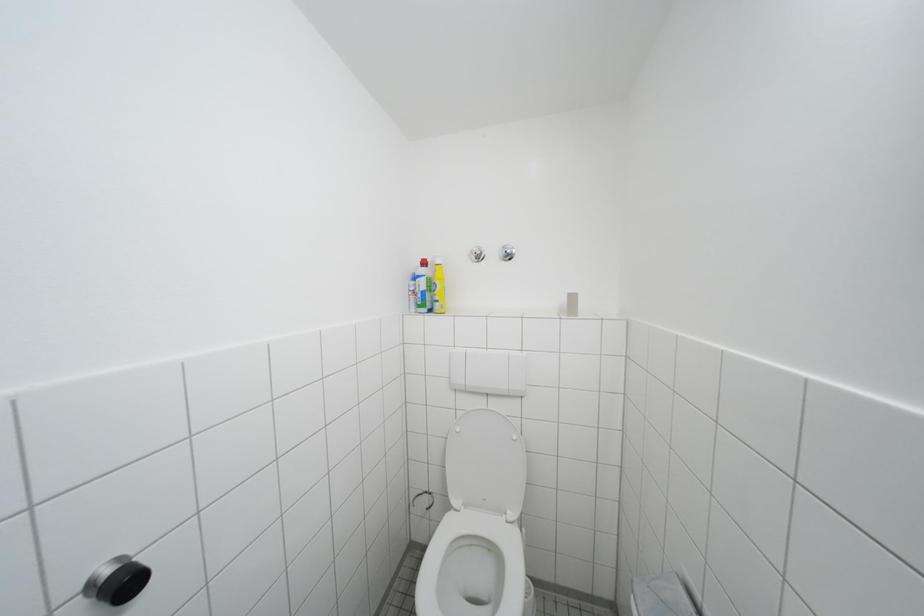
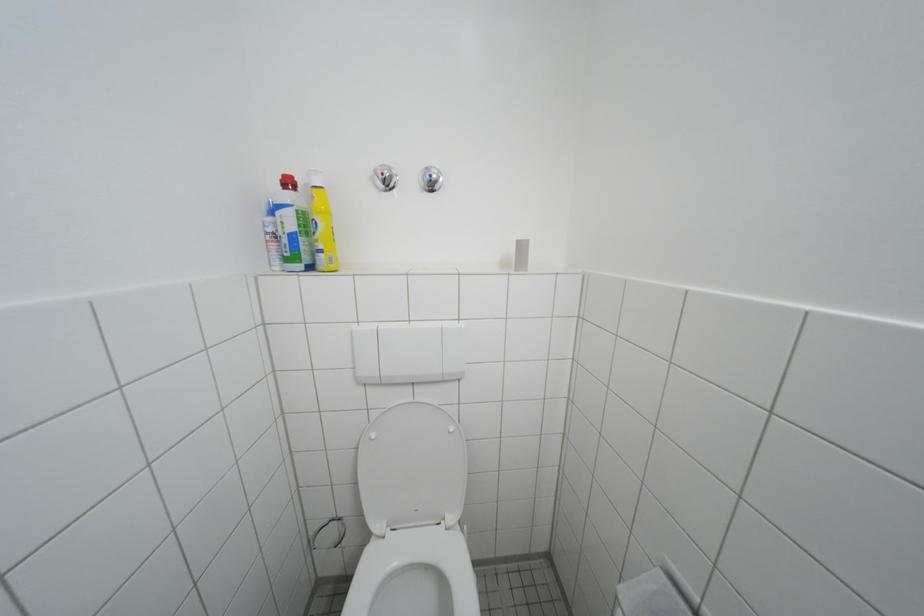
Question: The camera is either moving clockwise (left) or counter-clockwise (right) around the object. The first image is from the beginning of the video and the second image is from the end. Is the camera moving left or right when shooting the video?

Choices:
 (A) Left
 (B) Right

Answer: (A)